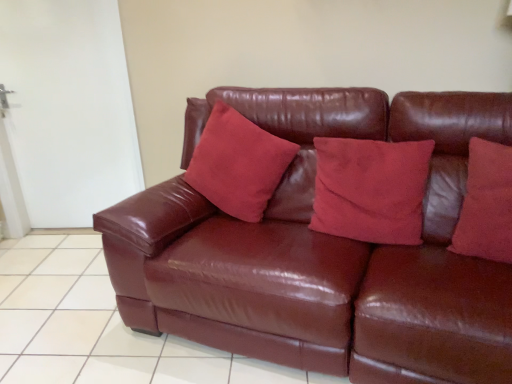
Question: Is suede-like red pillow at right, the third pillow from the left, closer to the viewer compared to shiny brown leather couch at center?

Choices:
 (A) yes
 (B) no

Answer: (B)

Question: Is suede-like red pillow at right, the third pillow from the left, to the right of shiny brown leather couch at center from the viewer's perspective?

Choices:
 (A) yes
 (B) no

Answer: (A)

Question: Does suede-like red pillow at right, which is counted as the 1th pillow, starting from the right, touch shiny brown leather couch at center?

Choices:
 (A) yes
 (B) no

Answer: (B)

Question: Can you confirm if suede-like red pillow at right, the third pillow from the left, is smaller than shiny brown leather couch at center?

Choices:
 (A) yes
 (B) no

Answer: (A)

Question: Can you confirm if suede-like red pillow at right, the third pillow from the left, is taller than shiny brown leather couch at center?

Choices:
 (A) yes
 (B) no

Answer: (B)

Question: In the image, is shiny brown leather couch at center positioned in front of or behind suede-like red pillow at right, which is counted as the 1th pillow, starting from the right?

Choices:
 (A) front
 (B) behind

Answer: (A)

Question: From a real-world perspective, is shiny brown leather couch at center physically located above or below suede-like red pillow at right, the third pillow from the left?

Choices:
 (A) above
 (B) below

Answer: (B)

Question: Considering the positions of shiny brown leather couch at center and suede-like red pillow at right, the third pillow from the left, in the image, is shiny brown leather couch at center taller or shorter than suede-like red pillow at right, the third pillow from the left,?

Choices:
 (A) short
 (B) tall

Answer: (B)

Question: Based on their sizes in the image, would you say shiny brown leather couch at center is bigger or smaller than suede-like red pillow at right, the third pillow from the left?

Choices:
 (A) small
 (B) big

Answer: (B)

Question: Looking at the image, does glossy leather couch at center seem bigger or smaller compared to suede-like red pillow at center, which is the second pillow from right to left?

Choices:
 (A) big
 (B) small

Answer: (A)

Question: From the image's perspective, is glossy leather couch at center positioned above or below suede-like red pillow at center, the second pillow in the left-to-right sequence?

Choices:
 (A) above
 (B) below

Answer: (B)

Question: Is glossy leather couch at center inside or outside of suede-like red pillow at center, which is the second pillow from right to left?

Choices:
 (A) inside
 (B) outside

Answer: (B)

Question: Is glossy leather couch at center to the left or to the right of suede-like red pillow at center, the second pillow in the left-to-right sequence, in the image?

Choices:
 (A) right
 (B) left

Answer: (B)

Question: Is shiny brown leather couch at center inside or outside of suede-like red pillow at center, the 3th pillow when ordered from right to left?

Choices:
 (A) inside
 (B) outside

Answer: (B)

Question: Is shiny brown leather couch at center in front of or behind suede-like red pillow at center, the 3th pillow when ordered from right to left, in the image?

Choices:
 (A) behind
 (B) front

Answer: (B)